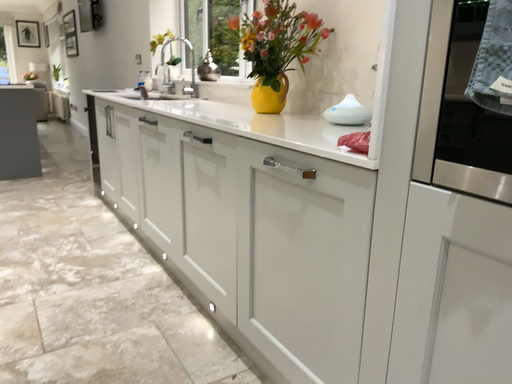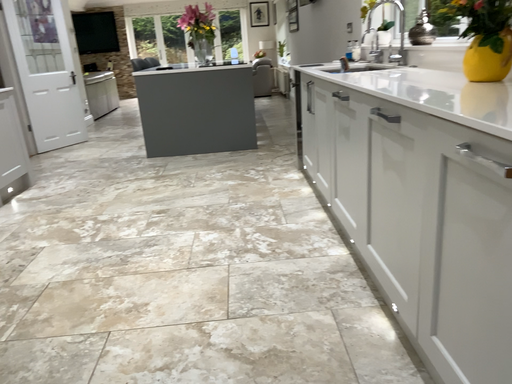
Question: How did the camera likely rotate when shooting the video?

Choices:
 (A) rotated right
 (B) rotated left

Answer: (B)